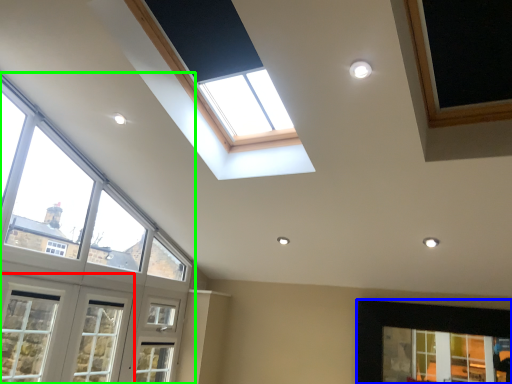
Question: Estimate the real-world distances between objects in this image. Which object is farther from window (highlighted by a red box), window (highlighted by a blue box) or window (highlighted by a green box)?

Choices:
 (A) window
 (B) window

Answer: (A)